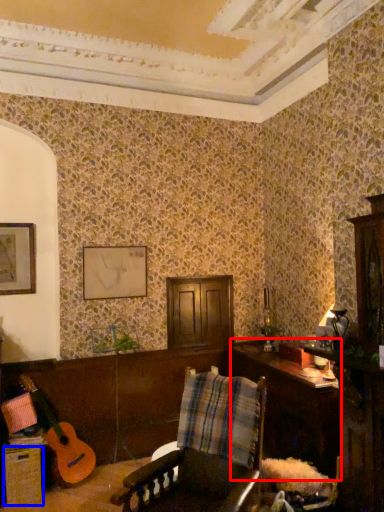
Question: Which object is closer to the camera taking this photo, table (highlighted by a red box) or drawer (highlighted by a blue box)?

Choices:
 (A) table
 (B) drawer

Answer: (A)